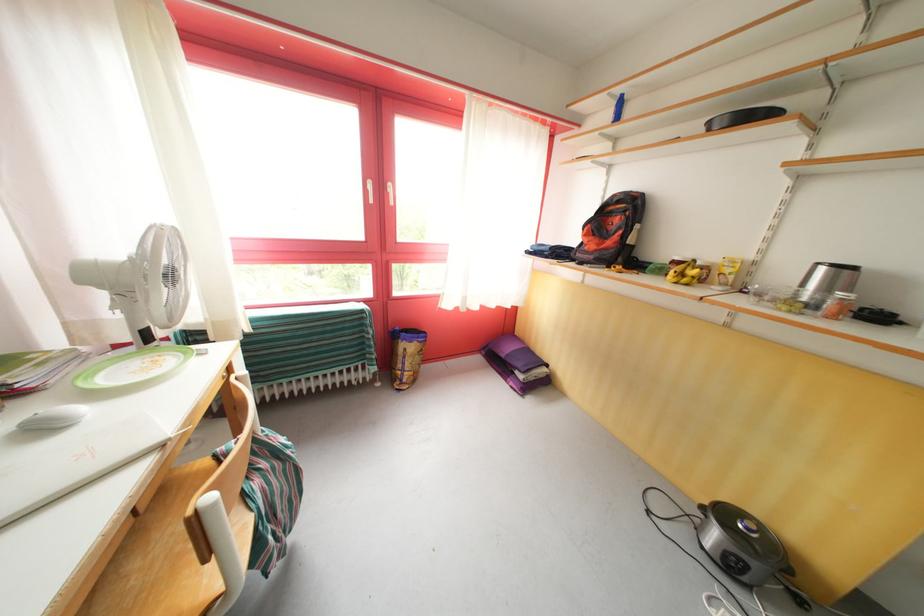
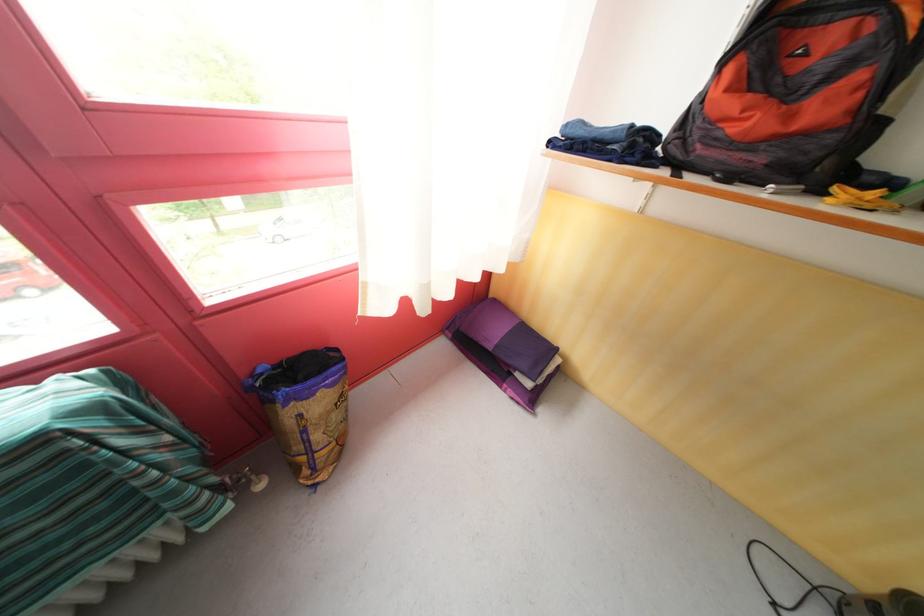
Find the pixel in the second image that matches the point at 593,257 in the first image.

(736, 151)